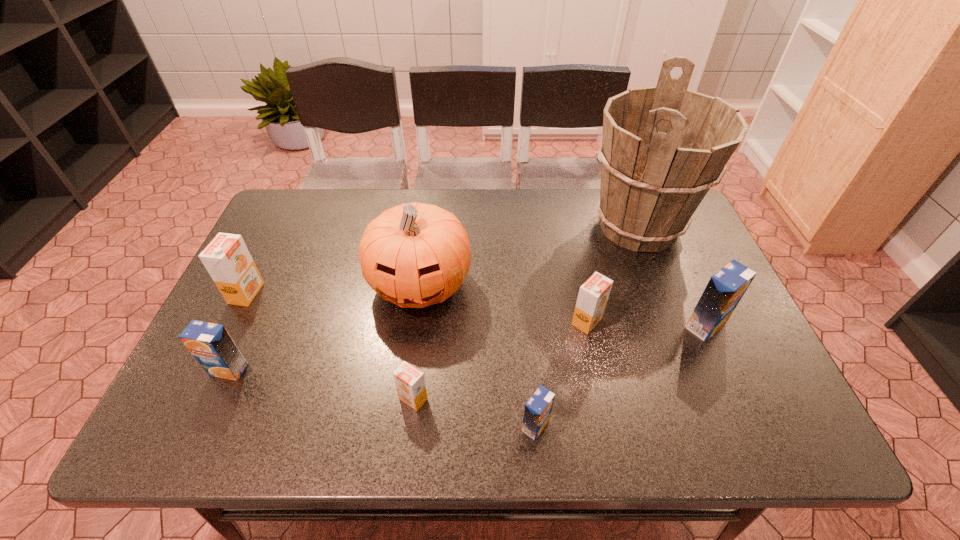
Locate an element on the screen. The image size is (960, 540). vacant region that satisfies the following two spatial constraints: 1. on the front-facing side of the second nearest orange_juice; 2. on the left side of the pumpkin is located at coordinates (405, 399).

At what (x,y) coordinates should I click in order to perform the action: click on vacant space that satisfies the following two spatial constraints: 1. on the back side of the bucket; 2. on the right side of the third nearest orange_juice. Please return your answer as a coordinate pair (x, y). This screenshot has width=960, height=540. Looking at the image, I should click on (294, 227).